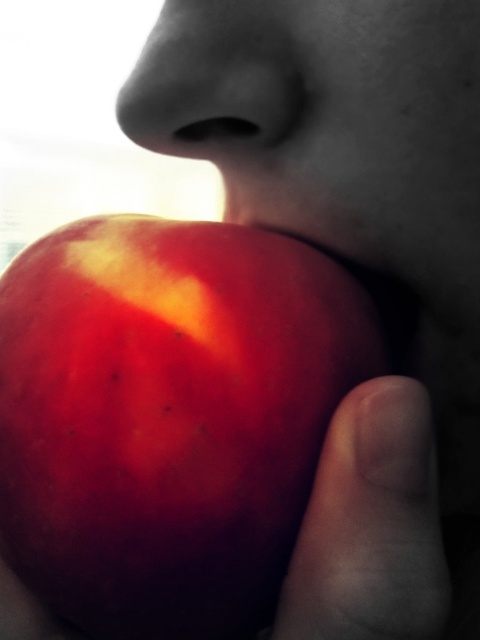
You are a nutritionist analyzing the image of a person biting into an apple. You need to determine if the shiny red apple at mouth can fit entirely in the hand of the smooth skin finger at lower right. Based on the provided information, what is your conclusion?

The shiny red apple at mouth is wider than the smooth skin finger at lower right, so it cannot fit entirely in the hand of the smooth skin finger at lower right.

You are a nutritionist analyzing the image of a person eating. You need to determine if the shiny red apple at mouth is larger than the smooth skin finger at lower right. Based on the spatial details, can you confirm this?

The shiny red apple at mouth has a greater height compared to the smooth skin finger at lower right, so yes, the shiny red apple at mouth is larger in height than the smooth skin finger at lower right.

You are a photographer adjusting the lighting for a closeup shot of a shiny red apple at mouth and a smooth skin finger at lower right. Based on the scene description, where should you position the light source to highlight both objects effectively?

The light source should be positioned to the right of the shiny red apple at mouth and smooth skin finger at lower right to create a high contrast effect and highlight both objects effectively, as the background is overexposed with natural sunlight likely coming from behind the subject.